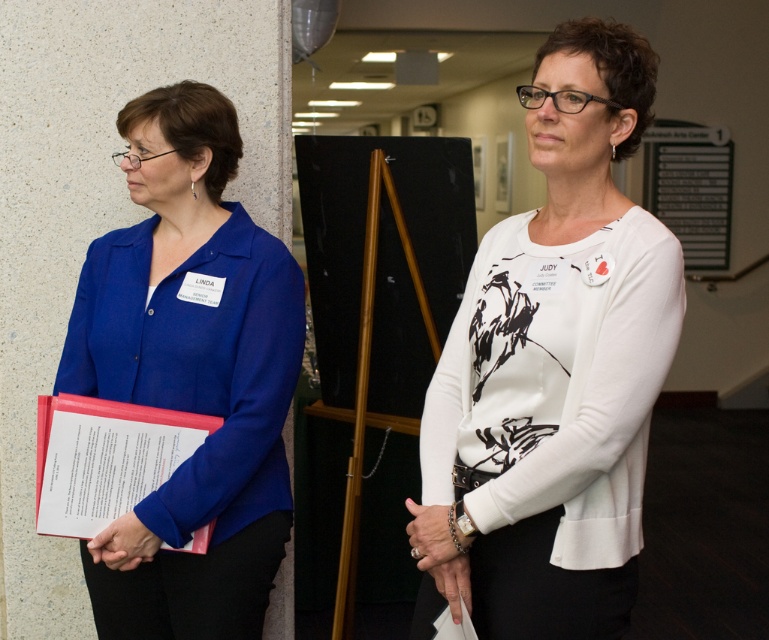
Describe the element at coordinates (553, 371) in the screenshot. I see `white matte sweater at center` at that location.

Is white matte sweater at center to the right of blue matte blazer at left from the viewer's perspective?

Yes, white matte sweater at center is to the right of blue matte blazer at left.

Is point (598, 108) closer to viewer compared to point (171, 636)?

Yes, it is in front of point (171, 636).

This screenshot has height=640, width=769. Find the location of `white matte sweater at center`. white matte sweater at center is located at coordinates (553, 371).